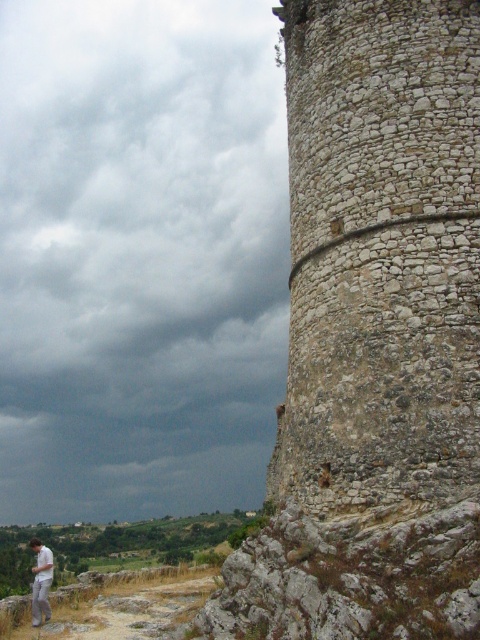
Is rough stone tower at right to the left of white cotton shirt at lower left from the viewer's perspective?

In fact, rough stone tower at right is to the right of white cotton shirt at lower left.

The height and width of the screenshot is (640, 480). I want to click on rough stone tower at right, so click(x=382, y=252).

Is dark gray cloud at upper left bigger than rough stone tower at right?

→ Indeed, dark gray cloud at upper left has a larger size compared to rough stone tower at right.

Which of these two, dark gray cloud at upper left or rough stone tower at right, stands shorter?

With less height is rough stone tower at right.

Find the location of `dark gray cloud at upper left`. dark gray cloud at upper left is located at coordinates (139, 257).

Between dark gray cloud at upper left and white cotton shirt at lower left, which one appears on the right side from the viewer's perspective?

Positioned to the right is white cotton shirt at lower left.

Which of these two, dark gray cloud at upper left or white cotton shirt at lower left, stands taller?

Standing taller between the two is dark gray cloud at upper left.

Locate an element on the screen. Image resolution: width=480 pixels, height=640 pixels. dark gray cloud at upper left is located at coordinates (139, 257).